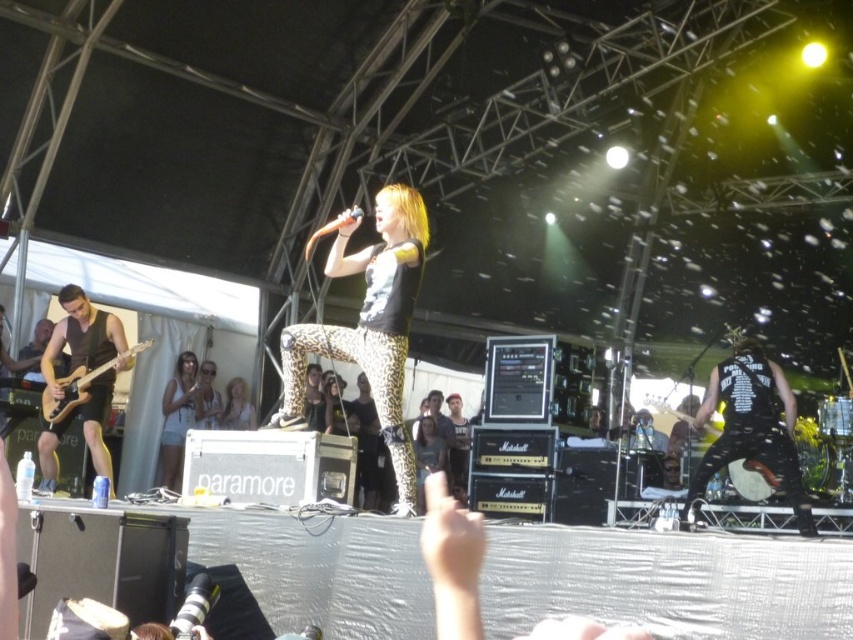
Can you confirm if leopard print pants at center is bigger than wooden drum at right?

Correct, leopard print pants at center is larger in size than wooden drum at right.

Can you confirm if leopard print pants at center is shorter than wooden drum at right?

In fact, leopard print pants at center may be taller than wooden drum at right.

Is point (230, 404) in front of point (648, 403)?

No, it is behind (648, 403).

I want to click on leopard print pants at center, so click(x=236, y=406).

Does white leopard print pants at center appear over sunglasses at center?

No, white leopard print pants at center is not above sunglasses at center.

Does white leopard print pants at center have a smaller size compared to sunglasses at center?

No.

This screenshot has width=853, height=640. Find the location of `white leopard print pants at center`. white leopard print pants at center is located at coordinates (177, 417).

Find the location of a particular element. The image size is (853, 640). white leopard print pants at center is located at coordinates (177, 417).

Does point (178, 472) come closer to viewer compared to point (677, 417)?

That is True.

Who is positioned more to the left, white leopard print pants at center or wooden drum at right?

Positioned to the left is white leopard print pants at center.

Does point (186, 413) come closer to viewer compared to point (683, 413)?

No, (186, 413) is behind (683, 413).

Locate an element on the screen. The image size is (853, 640). white leopard print pants at center is located at coordinates (177, 417).